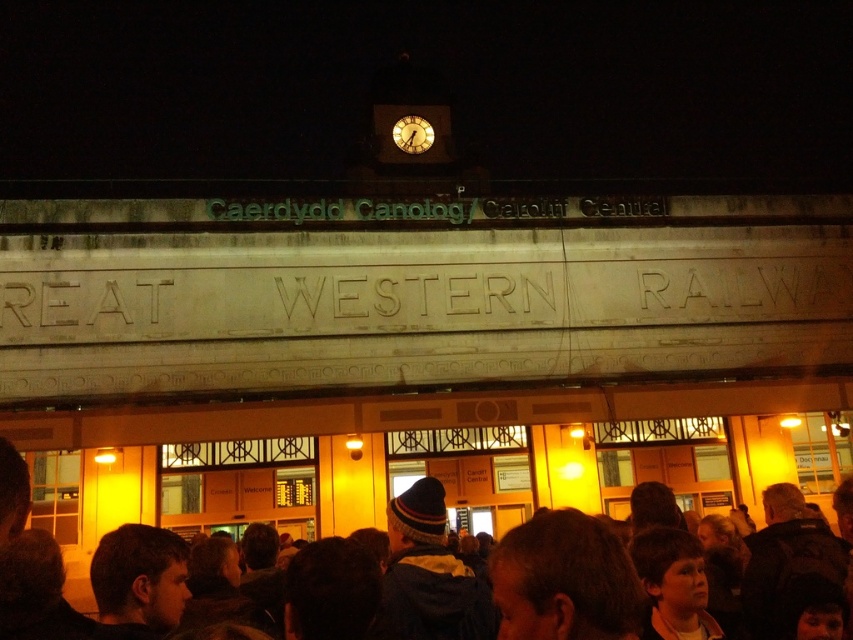
Question: Which point is farther from the camera taking this photo?

Choices:
 (A) (558, 563)
 (B) (428, 124)

Answer: (B)

Question: Can you confirm if brown woolen hat at center is positioned to the right of matte white clock at center?

Choices:
 (A) no
 (B) yes

Answer: (B)

Question: Is brown woolen hat at center closer to camera compared to matte white clock at center?

Choices:
 (A) no
 (B) yes

Answer: (B)

Question: Does brown woolen hat at center lie behind matte white clock at center?

Choices:
 (A) no
 (B) yes

Answer: (A)

Question: Which point is farther from the camera taking this photo?

Choices:
 (A) (398, 147)
 (B) (564, 621)

Answer: (A)

Question: Among these points, which one is nearest to the camera?

Choices:
 (A) (432, 125)
 (B) (575, 515)

Answer: (B)